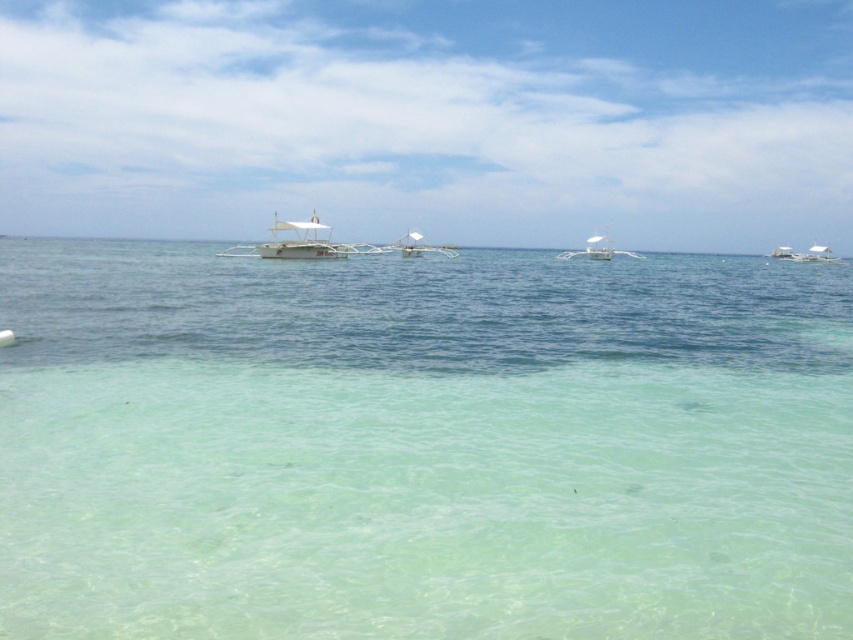
Is white wooden boat at center behind white plastic boat at right?

No, it is not.

Is point (410, 234) more distant than point (781, 253)?

No, (410, 234) is in front of (781, 253).

Between point (392, 244) and point (799, 257), which one is positioned behind?

The point (392, 244) is behind.

The width and height of the screenshot is (853, 640). What are the coordinates of `white wooden boat at center` in the screenshot? It's located at (418, 246).

Which is more to the left, clear water at center or white glossy boat at center?

clear water at center

Between clear water at center and white glossy boat at center, which one is positioned lower?

Positioned lower is clear water at center.

Identify the location of clear water at center. (422, 445).

Who is shorter, clear water at center or white matte boat at center?

clear water at center is shorter.

Can you confirm if clear water at center is thinner than white matte boat at center?

Incorrect, clear water at center's width is not less than white matte boat at center's.

I want to click on clear water at center, so click(x=422, y=445).